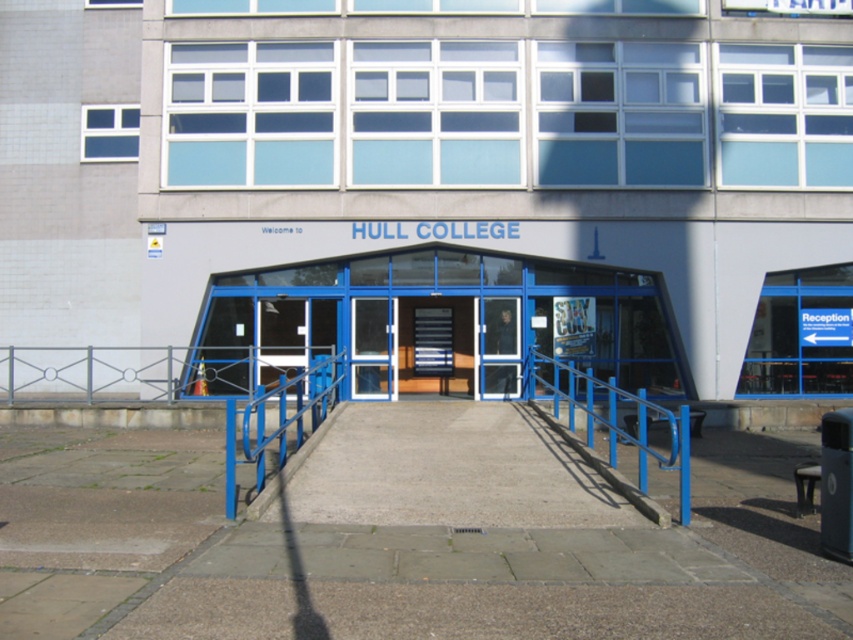
Question: Estimate the real-world distances between objects in this image. Which object is farther from the blue metallic rail at center?

Choices:
 (A) blue metallic handrail at center
 (B) wooden staircase at center
 (C) transparent glass door at center

Answer: (B)

Question: Is transparent glass door at center positioned at the back of wooden staircase at center?

Choices:
 (A) yes
 (B) no

Answer: (B)

Question: Is blue metallic rail at center below transparent glass door at center?

Choices:
 (A) yes
 (B) no

Answer: (A)

Question: Among these objects, which one is nearest to the camera?

Choices:
 (A) blue metallic rail at center
 (B) transparent glass door at center

Answer: (A)

Question: Can you confirm if transparent glass door at center is smaller than wooden staircase at center?

Choices:
 (A) yes
 (B) no

Answer: (B)

Question: Which point is closer to the camera?

Choices:
 (A) wooden staircase at center
 (B) transparent glass door at center

Answer: (B)